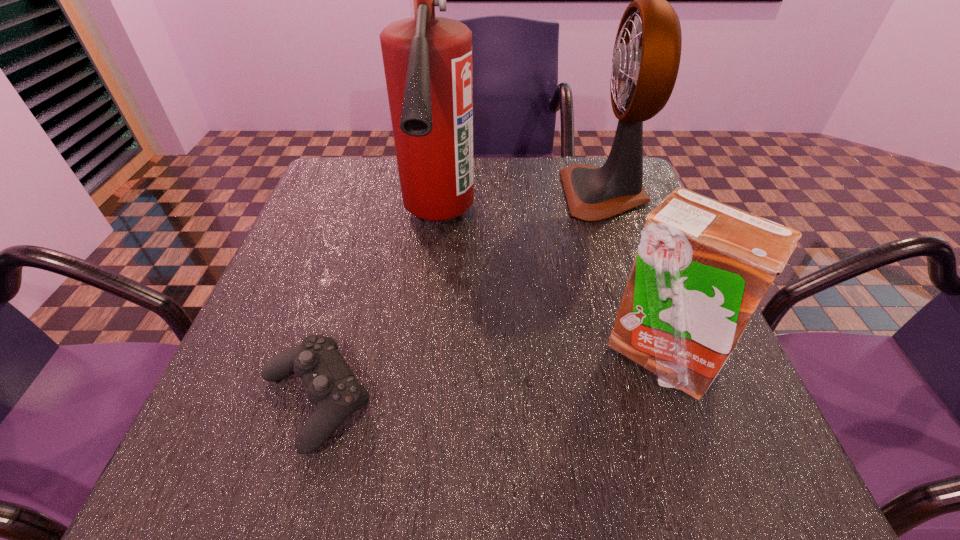
Where is `the tallest object`? the tallest object is located at coordinates (427, 60).

Locate an element on the screen. the third shortest object is located at coordinates (646, 57).

The height and width of the screenshot is (540, 960). I want to click on carton, so click(x=702, y=268).

Find the location of a particular element. This screenshot has width=960, height=540. the shortest object is located at coordinates (332, 387).

Locate an element on the screen. vacant point located at the nozzle of the fire extinguisher is located at coordinates (415, 423).

In order to click on vacant space located 0.180m on the front-facing side of the third shortest object in this screenshot , I will do `click(493, 193)`.

Find the location of a particular element. The width and height of the screenshot is (960, 540). free space located on the front-facing side of the third shortest object is located at coordinates (446, 193).

Locate an element on the screen. This screenshot has width=960, height=540. free space located on the front-facing side of the third shortest object is located at coordinates (469, 193).

Where is `free space located 0.060m on the straw side of the second shortest object`? The image size is (960, 540). free space located 0.060m on the straw side of the second shortest object is located at coordinates (690, 441).

At what (x,y) coordinates should I click in order to perform the action: click on vacant space located 0.200m on the back of the shortest object. Please return your answer as a coordinate pair (x, y). Looking at the image, I should click on (354, 271).